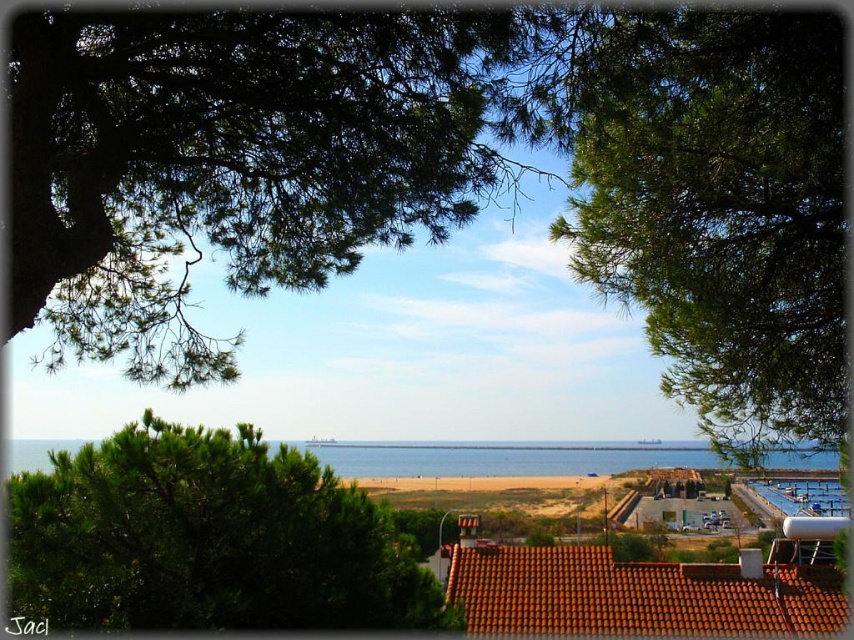
Is point (342, 230) less distant than point (395, 596)?

No.

Does point (132, 276) come behind point (9, 573)?

Yes, point (132, 276) is behind point (9, 573).

This screenshot has width=854, height=640. I want to click on green needle-like leaves at upper center, so click(x=244, y=156).

Between green needle-like leaves at upper center and green leafy tree at upper center, which one has less height?

green needle-like leaves at upper center

In order to click on green needle-like leaves at upper center in this screenshot , I will do coord(244,156).

At what (x,y) coordinates should I click in order to perform the action: click on green leafy tree at upper center. Please return your answer as a coordinate pair (x, y). This screenshot has height=640, width=854. Looking at the image, I should click on (722, 211).

Which is in front, point (648, 333) or point (474, 458)?

Point (648, 333)

The width and height of the screenshot is (854, 640). Identify the location of green leafy tree at upper center. (722, 211).